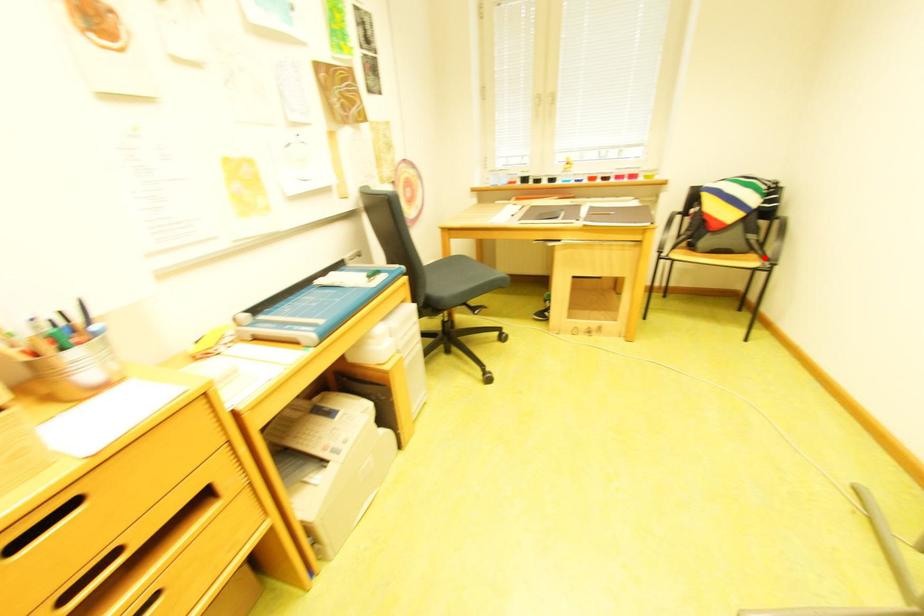
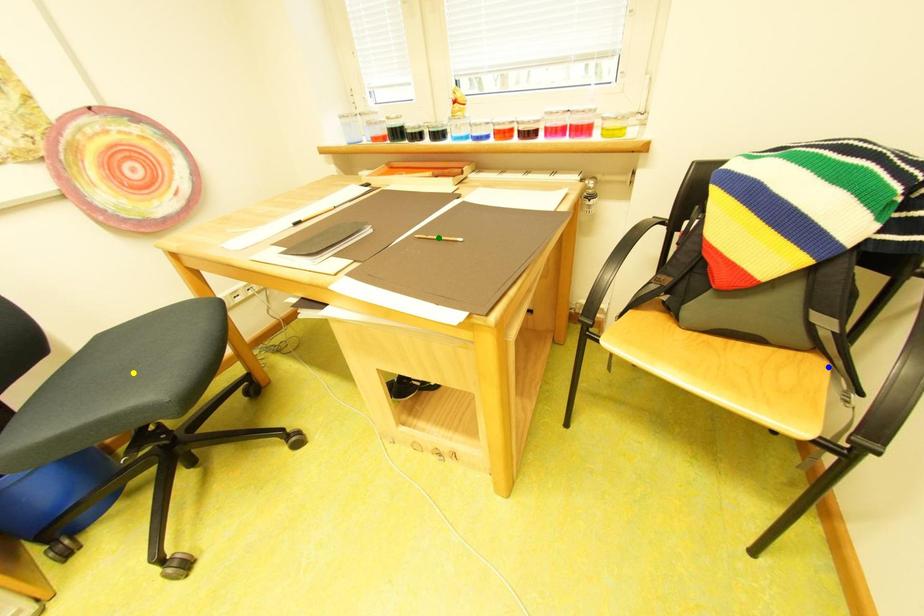
Question: I am providing you with two images of the same scene from different viewpoints. A red point is marked on the first image. You are given multiple points on the second image. Which spot in image 2 lines up with the point in image 1?

Choices:
 (A) green point
 (B) blue point
 (C) yellow point

Answer: (B)